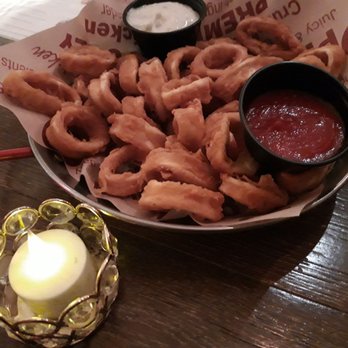
At what (x,y) coordinates should I click in order to perform the action: click on black condiment bowls. Please return your answer as a coordinate pair (x, y). This screenshot has width=348, height=348. Looking at the image, I should click on (163, 38), (252, 143).